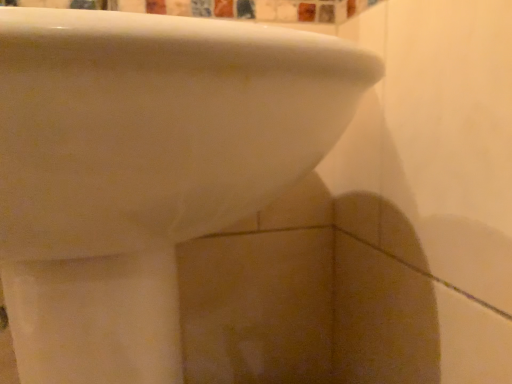
Where is `white glossy toilet at upper center`? white glossy toilet at upper center is located at coordinates (143, 169).

This screenshot has width=512, height=384. What do you see at coordinates (143, 169) in the screenshot?
I see `white glossy toilet at upper center` at bounding box center [143, 169].

Measure the distance between point (113,119) and camera.

Point (113,119) and camera are 7.99 inches apart.

At what (x,y) coordinates should I click in order to perform the action: click on white glossy toilet at upper center. Please return your answer as a coordinate pair (x, y). The height and width of the screenshot is (384, 512). Looking at the image, I should click on (143, 169).